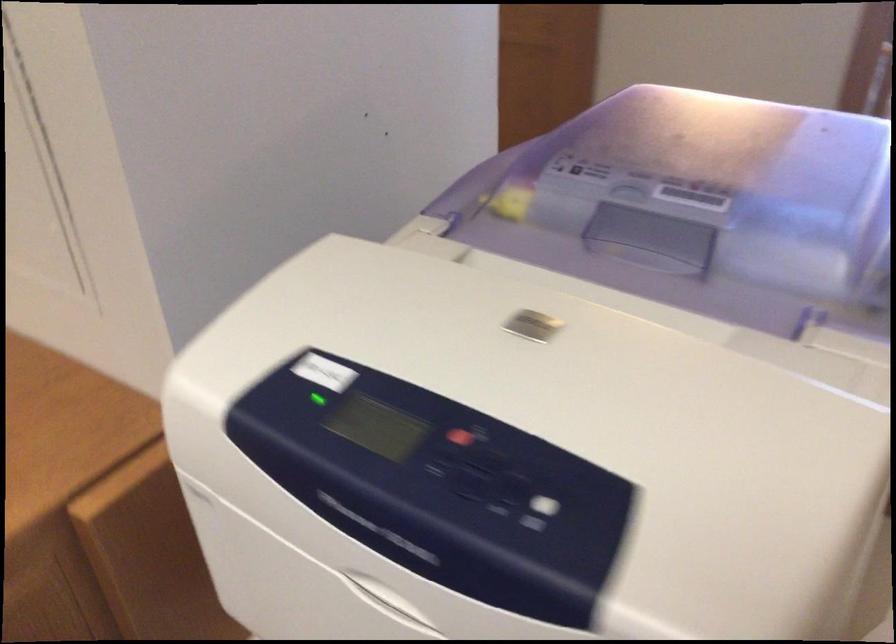
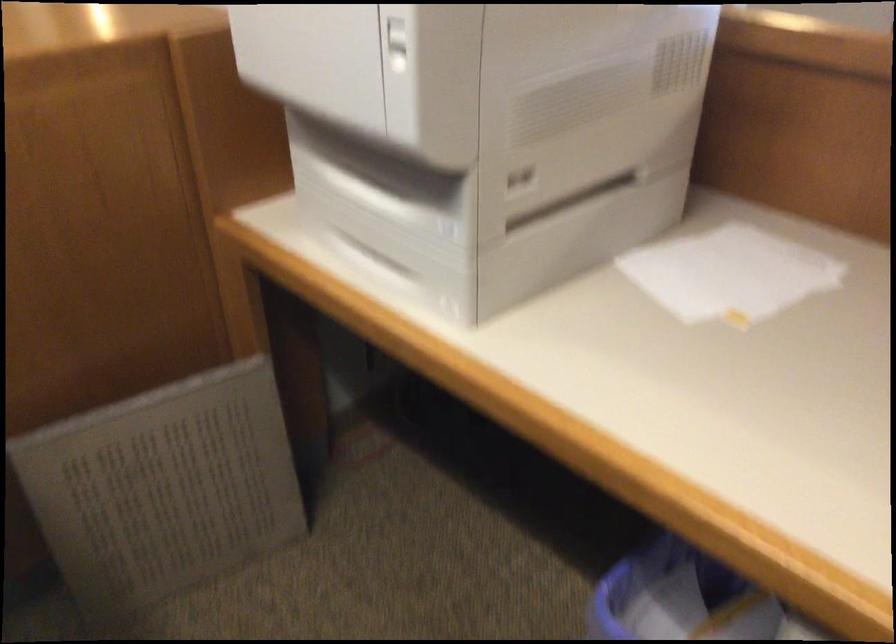
What movement of the cameraman would produce the second image?

The cameraman walked toward right, backward.